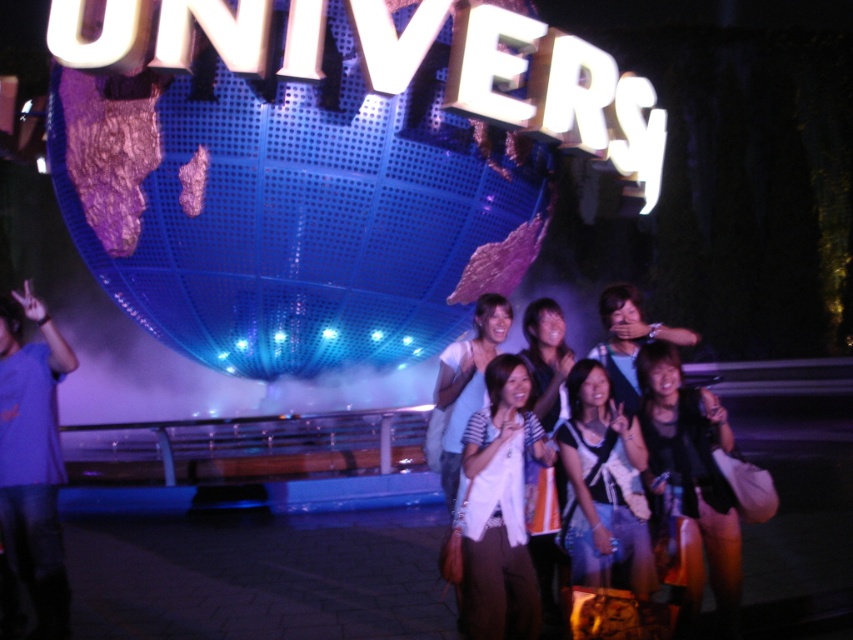
Question: Which point is closer to the camera?

Choices:
 (A) white fabric shirt at center
 (B) matte blue shirt at left
 (C) white fabric at center
 (D) black leather jacket at center

Answer: (D)

Question: Can you confirm if white fabric at center is thinner than black leather jacket at center?

Choices:
 (A) no
 (B) yes

Answer: (B)

Question: Can you confirm if matte blue shirt at left is smaller than black leather jacket at center?

Choices:
 (A) yes
 (B) no

Answer: (B)

Question: Is matte blue shirt at left smaller than white fabric shirt at center?

Choices:
 (A) no
 (B) yes

Answer: (A)

Question: Which of the following is the farthest from the observer?

Choices:
 (A) (460, 342)
 (B) (469, 616)
 (C) (56, 428)
 (D) (712, 541)

Answer: (A)

Question: Which object is farther from the camera taking this photo?

Choices:
 (A) white fabric shirt at center
 (B) denim jacket at center
 (C) black leather jacket at center
 (D) matte blue shirt at left

Answer: (A)